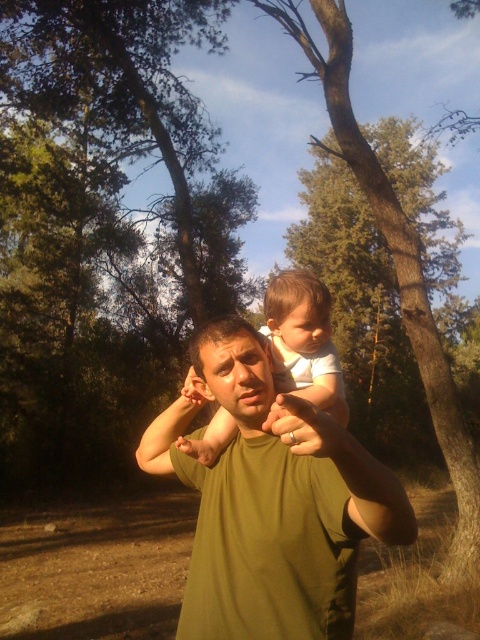
Question: Which of the following is the farthest from the observer?

Choices:
 (A) (222, 570)
 (B) (186, 444)

Answer: (B)

Question: Is green matte shirt at center smaller than white cotton baby at center?

Choices:
 (A) yes
 (B) no

Answer: (A)

Question: Among these points, which one is farthest from the camera?

Choices:
 (A) (276, 564)
 (B) (205, 452)

Answer: (B)

Question: Is green matte shirt at center closer to camera compared to white cotton baby at center?

Choices:
 (A) no
 (B) yes

Answer: (B)

Question: Which object is farther from the camera taking this photo?

Choices:
 (A) white cotton baby at center
 (B) green matte shirt at center

Answer: (A)

Question: Can you confirm if green matte shirt at center is positioned above white cotton baby at center?

Choices:
 (A) no
 (B) yes

Answer: (A)